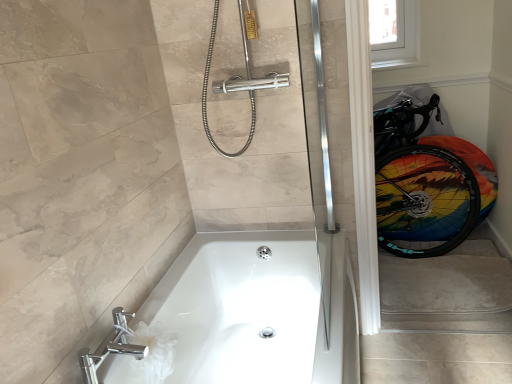
Locate an element on the screen. The image size is (512, 384). transparent plastic window screen at upper right is located at coordinates (400, 40).

Find the location of a particular element. The height and width of the screenshot is (384, 512). rainbow painted tire at right is located at coordinates (424, 201).

You are a GUI agent. You are given a task and a screenshot of the screen. Output one action in this format:
    pyautogui.click(x=<x>, y=<y>)
    Task: Click on the white glossy bathtub at lower center
    This screenshot has height=384, width=512.
    Given the screenshot: What is the action you would take?
    pyautogui.click(x=255, y=311)

At what (x,y) coordinates should I click in order to perform the action: click on chrome/metallic faucet at lower left. Please return your answer as a coordinate pair (x, y). This screenshot has height=384, width=512. Looking at the image, I should click on (110, 347).

In the scene shown: Is white glossy toilet paper at lower left facing away from white glossy bathtub at lower center?

That's right, white glossy toilet paper at lower left is facing away from white glossy bathtub at lower center.

Can you confirm if white glossy toilet paper at lower left is thinner than white glossy bathtub at lower center?

Yes.

Who is taller, white glossy toilet paper at lower left or white glossy bathtub at lower center?

white glossy bathtub at lower center.

Can white glossy toilet paper at lower left be found inside chrome/metallic faucet at lower left?

No, white glossy toilet paper at lower left is not inside chrome/metallic faucet at lower left.

Who is shorter, chrome/metallic faucet at lower left or white glossy toilet paper at lower left?

chrome/metallic faucet at lower left is shorter.

Does chrome/metallic faucet at lower left have a smaller size compared to white glossy toilet paper at lower left?

Indeed, chrome/metallic faucet at lower left has a smaller size compared to white glossy toilet paper at lower left.

Considering the relative sizes of chrome/metallic faucet at lower left and white glossy toilet paper at lower left in the image provided, is chrome/metallic faucet at lower left thinner than white glossy toilet paper at lower left?

In fact, chrome/metallic faucet at lower left might be wider than white glossy toilet paper at lower left.

Considering the positions of objects white glossy bathtub at lower center and white glossy toilet paper at lower left in the image provided, who is more to the right, white glossy bathtub at lower center or white glossy toilet paper at lower left?

From the viewer's perspective, white glossy bathtub at lower center appears more on the right side.

Are white glossy bathtub at lower center and white glossy toilet paper at lower left located far from each other?

That's not correct — white glossy bathtub at lower center is a little close to white glossy toilet paper at lower left.

From a real-world perspective, is white glossy bathtub at lower center beneath white glossy toilet paper at lower left?

Yes, from a real-world perspective, white glossy bathtub at lower center is below white glossy toilet paper at lower left.

Considering the positions of objects white glossy bathtub at lower center and white glossy toilet paper at lower left in the image provided, who is in front, white glossy bathtub at lower center or white glossy toilet paper at lower left?

white glossy bathtub at lower center is more forward.

Which object is thinner, white glossy toilet paper at lower left or chrome/metallic faucet at lower left?

white glossy toilet paper at lower left is thinner.

Is white glossy toilet paper at lower left far away from chrome/metallic faucet at lower left?

white glossy toilet paper at lower left is near chrome/metallic faucet at lower left, not far away.

Consider the image. How different are the orientations of white glossy toilet paper at lower left and chrome/metallic faucet at lower left in degrees?

0.000437 degrees separate the facing orientations of white glossy toilet paper at lower left and chrome/metallic faucet at lower left.

Does white glossy toilet paper at lower left turn towards chrome/metallic faucet at lower left?

No, white glossy toilet paper at lower left is not turned towards chrome/metallic faucet at lower left.

Between white glossy bathtub at lower center and transparent plastic window screen at upper right, which one is positioned in front?

white glossy bathtub at lower center is in front.

Between white glossy bathtub at lower center and transparent plastic window screen at upper right, which one has smaller size?

transparent plastic window screen at upper right.

Are white glossy bathtub at lower center and transparent plastic window screen at upper right far apart?

Absolutely, white glossy bathtub at lower center is distant from transparent plastic window screen at upper right.

Considering the relative sizes of white glossy bathtub at lower center and transparent plastic window screen at upper right in the image provided, is white glossy bathtub at lower center taller than transparent plastic window screen at upper right?

Correct, white glossy bathtub at lower center is much taller as transparent plastic window screen at upper right.

Which of these two, white glossy bathtub at lower center or chrome/metallic faucet at lower left, is bigger?

white glossy bathtub at lower center.

Considering the relative positions of white glossy bathtub at lower center and chrome/metallic faucet at lower left in the image provided, is white glossy bathtub at lower center to the right of chrome/metallic faucet at lower left from the viewer's perspective?

Yes, white glossy bathtub at lower center is to the right of chrome/metallic faucet at lower left.

Which is farther, (102,342) or (129,328)?

The point (129,328) is more distant.

Does white glossy bathtub at lower center turn towards chrome/metallic faucet at lower left?

No, white glossy bathtub at lower center is not turned towards chrome/metallic faucet at lower left.

Is transparent plastic window screen at upper right positioned far away from rainbow painted tire at right?

That's not correct — transparent plastic window screen at upper right is a little close to rainbow painted tire at right.

Can you confirm if transparent plastic window screen at upper right is smaller than rainbow painted tire at right?

Correct, transparent plastic window screen at upper right occupies less space than rainbow painted tire at right.

Who is more distant, transparent plastic window screen at upper right or rainbow painted tire at right?

transparent plastic window screen at upper right is further away from the camera.

In order to click on window screen above the rainbow painted tire at right (from the image's perspective) in this screenshot , I will do `click(400, 40)`.

Identify the location of bathtub below the white glossy toilet paper at lower left (from a real-world perspective). Image resolution: width=512 pixels, height=384 pixels. (255, 311).

Identify the location of tap on the left of white glossy toilet paper at lower left. (110, 347).

Estimate the real-world distances between objects in this image. Which object is further from white glossy bathtub at lower center, white glossy toilet paper at lower left or transparent plastic window screen at upper right?

Based on the image, transparent plastic window screen at upper right appears to be further to white glossy bathtub at lower center.

Estimate the real-world distances between objects in this image. Which object is further from chrome/metallic faucet at lower left, white glossy bathtub at lower center or rainbow painted tire at right?

rainbow painted tire at right is positioned further to the anchor chrome/metallic faucet at lower left.

Which object lies further to the anchor point transparent plastic window screen at upper right, white glossy bathtub at lower center or white glossy toilet paper at lower left?

Among the two, white glossy toilet paper at lower left is located further to transparent plastic window screen at upper right.

Looking at the image, which one is located closer to rainbow painted tire at right, transparent plastic window screen at upper right or chrome/metallic faucet at lower left?

Based on the image, transparent plastic window screen at upper right appears to be nearer to rainbow painted tire at right.

Considering their positions, is white glossy toilet paper at lower left positioned closer to chrome/metallic faucet at lower left than transparent plastic window screen at upper right?

Based on the image, white glossy toilet paper at lower left appears to be nearer to chrome/metallic faucet at lower left.

Considering their positions, is chrome/metallic faucet at lower left positioned further to transparent plastic window screen at upper right than white glossy toilet paper at lower left?

Based on the image, chrome/metallic faucet at lower left appears to be further to transparent plastic window screen at upper right.

Considering their positions, is transparent plastic window screen at upper right positioned closer to chrome/metallic faucet at lower left than white glossy toilet paper at lower left?

Based on the image, white glossy toilet paper at lower left appears to be nearer to chrome/metallic faucet at lower left.

From the image, which object appears to be farther from white glossy toilet paper at lower left, rainbow painted tire at right or white glossy bathtub at lower center?

Based on the image, rainbow painted tire at right appears to be further to white glossy toilet paper at lower left.

The width and height of the screenshot is (512, 384). In order to click on bicycle wheel between transparent plastic window screen at upper right and white glossy toilet paper at lower left vertically in this screenshot , I will do `click(424, 201)`.

Where is `bathtub situated between white glossy toilet paper at lower left and rainbow painted tire at right from left to right`? bathtub situated between white glossy toilet paper at lower left and rainbow painted tire at right from left to right is located at coordinates (255, 311).

This screenshot has width=512, height=384. I want to click on bathtub between chrome/metallic faucet at lower left and rainbow painted tire at right from left to right, so click(x=255, y=311).

The height and width of the screenshot is (384, 512). Identify the location of toilet paper between transparent plastic window screen at upper right and white glossy bathtub at lower center from top to bottom. (149, 354).